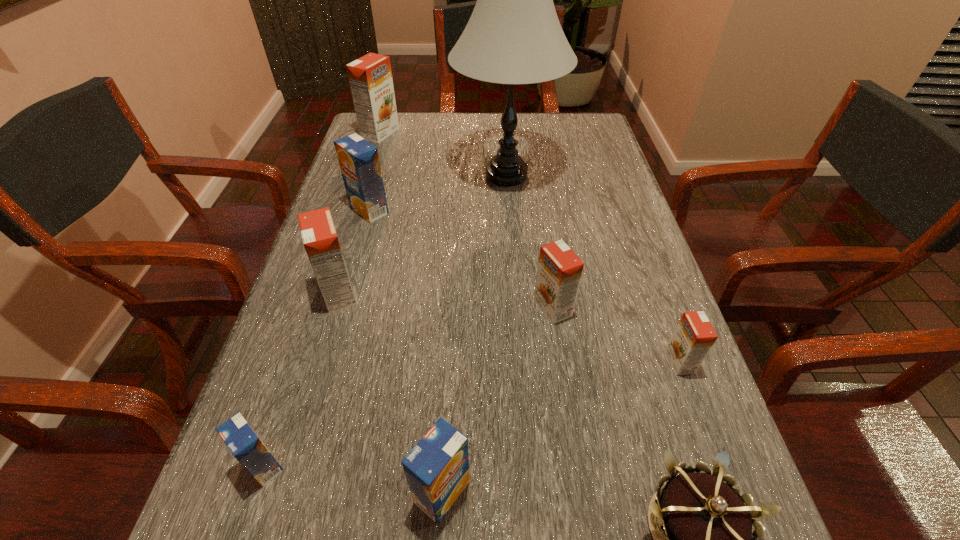
Find the location of a particular element. the fifth orange juice from left to right is located at coordinates (437, 468).

Image resolution: width=960 pixels, height=540 pixels. I want to click on the smallest blue orange_juice, so click(245, 445).

I want to click on the third nearest orange juice, so click(x=694, y=336).

You are a GUI agent. You are given a task and a screenshot of the screen. Output one action in this format:
    pyautogui.click(x=<x>, y=<y>)
    Task: Click on the nearest orange orange juice
    Image resolution: width=960 pixels, height=540 pixels.
    Given the screenshot: What is the action you would take?
    pyautogui.click(x=694, y=336)

Identify the location of free space located on the left of the black lamp. (431, 175).

Locate an element on the screen. The height and width of the screenshot is (540, 960). vacant space located 0.250m on the front of the farthest object is located at coordinates (361, 193).

Where is `free point located on the back of the farthest blue orange_juice`? The width and height of the screenshot is (960, 540). free point located on the back of the farthest blue orange_juice is located at coordinates (385, 154).

This screenshot has height=540, width=960. I want to click on vacant space situated on the back of the second biggest orange orange juice, so click(x=368, y=197).

You are a GUI agent. You are given a task and a screenshot of the screen. Output one action in this format:
    pyautogui.click(x=<x>, y=<y>)
    Task: Click on the vacant space located on the back of the second orange juice from right to left
    The image size is (960, 540).
    Given the screenshot: What is the action you would take?
    pyautogui.click(x=544, y=255)

Locate an element on the screen. Image resolution: width=960 pixels, height=540 pixels. free location located 0.250m on the left of the rightmost blue orange_juice is located at coordinates (241, 492).